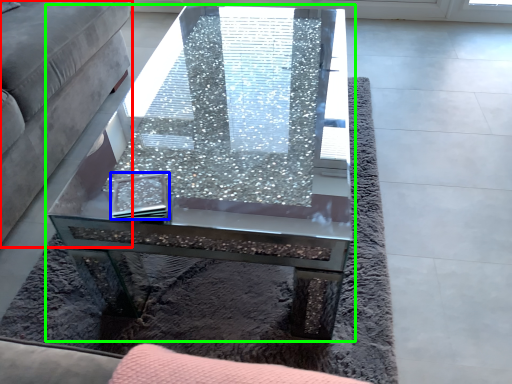
Question: Based on their relative distances, which object is farther from studio couch (highlighted by a red box)? Choose from pad (highlighted by a blue box) and coffee table (highlighted by a green box).

Choices:
 (A) pad
 (B) coffee table

Answer: (A)